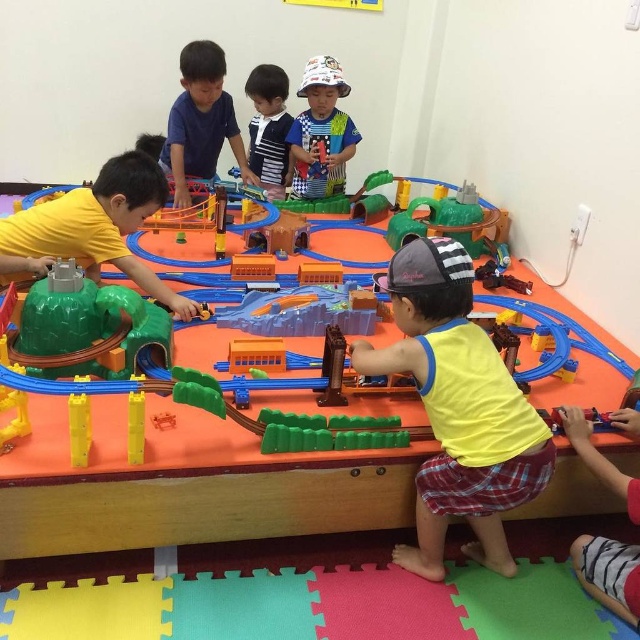
Question: Does yellow matte toy car at center have a larger size compared to green plastic train track at center?

Choices:
 (A) yes
 (B) no

Answer: (B)

Question: Which object is closer to the camera taking this photo?

Choices:
 (A) yellow matte toy car at center
 (B) white cotton hat at center
 (C) matte blue shirt at center

Answer: (A)

Question: Is matte blue shirt at center positioned at the back of white cotton hat at center?

Choices:
 (A) no
 (B) yes

Answer: (A)

Question: Which of the following is the farthest from the observer?

Choices:
 (A) yellow matte toy car at center
 (B) white cotton hat at center
 (C) striped fabric shirt at center
 (D) matte blue shirt at center

Answer: (C)

Question: Estimate the real-world distances between objects in this image. Which object is farther from the white cotton hat at center?

Choices:
 (A) matte blue shirt at center
 (B) yellow matte toy car at center
 (C) yellow fabric shirt at center

Answer: (C)

Question: Is the position of yellow fabric shirt at center less distant than that of yellow matte toy car at center?

Choices:
 (A) no
 (B) yes

Answer: (B)